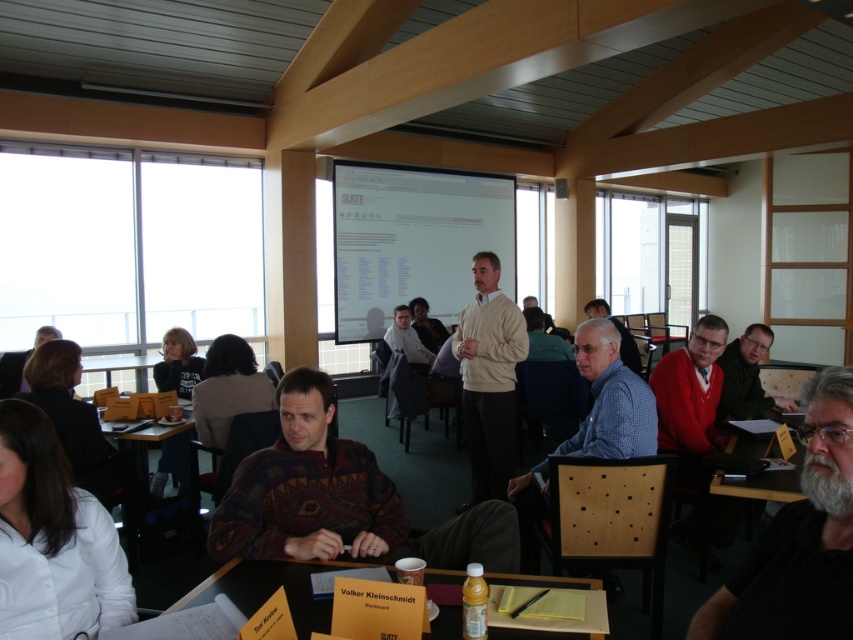
Image resolution: width=853 pixels, height=640 pixels. Describe the element at coordinates (267, 589) in the screenshot. I see `wooden table at lower center` at that location.

Is point (288, 572) positioned behind point (403, 307)?

No.

Identify the location of wooden table at lower center. (267, 589).

Does beige sweater at center appear under matte brown sweater at center?

Yes.

Does beige sweater at center have a lesser height compared to matte brown sweater at center?

In fact, beige sweater at center may be taller than matte brown sweater at center.

You are a GUI agent. You are given a task and a screenshot of the screen. Output one action in this format:
    pyautogui.click(x=<x>, y=<y>)
    Task: Click on the beige sweater at center
    The height and width of the screenshot is (640, 853).
    Given the screenshot: What is the action you would take?
    pyautogui.click(x=489, y=378)

Does multicolored knitted sweater at center lie behind dark blue sweater at center?

No, multicolored knitted sweater at center is in front of dark blue sweater at center.

Who is shorter, multicolored knitted sweater at center or dark blue sweater at center?

With less height is dark blue sweater at center.

At what (x,y) coordinates should I click in order to perform the action: click on multicolored knitted sweater at center. Please return your answer as a coordinate pair (x, y). Image resolution: width=853 pixels, height=640 pixels. Looking at the image, I should click on (340, 499).